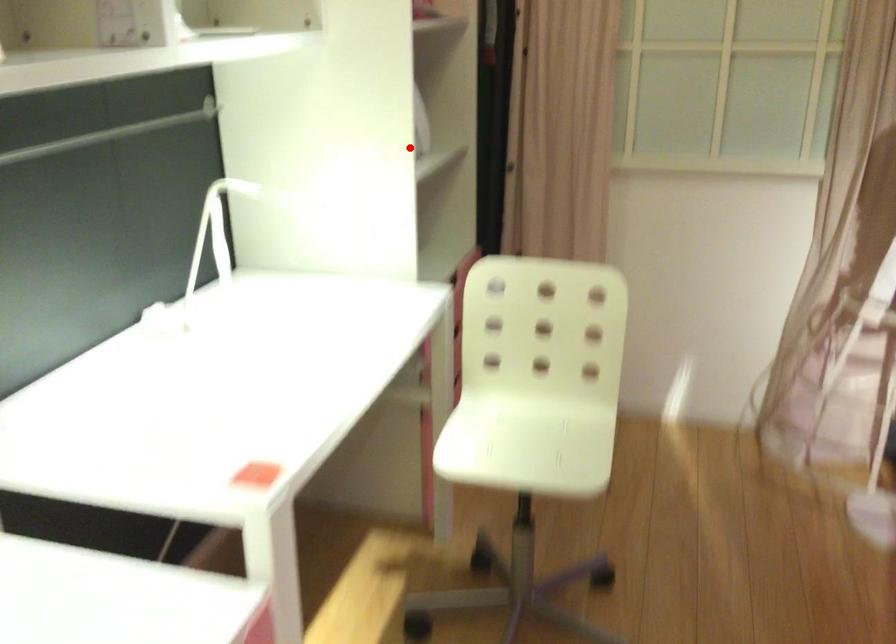
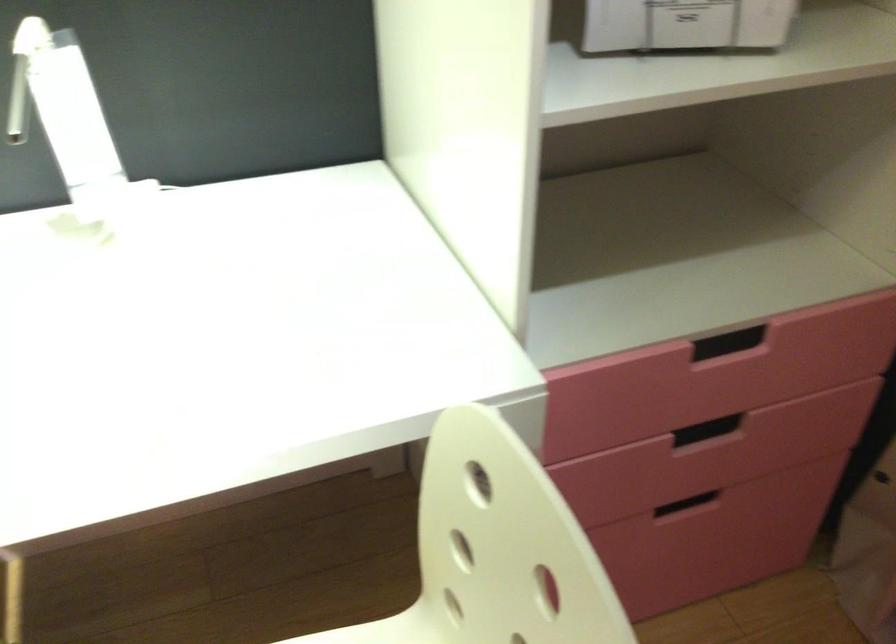
Question: I am providing you with two images of the same scene from different viewpoints. In image1, a red point is highlighted. Considering the same 3D point in image2, which of the following is correct?

Choices:
 (A) It is closer
 (B) It is farther

Answer: (A)